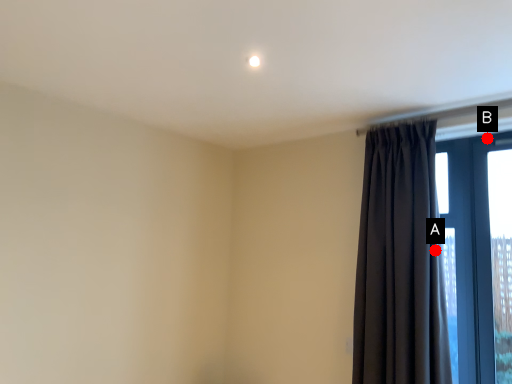
Question: Two points are circled on the image, labeled by A and B beside each circle. Which point is farther from the camera taking this photo?

Choices:
 (A) A is further
 (B) B is further

Answer: (B)